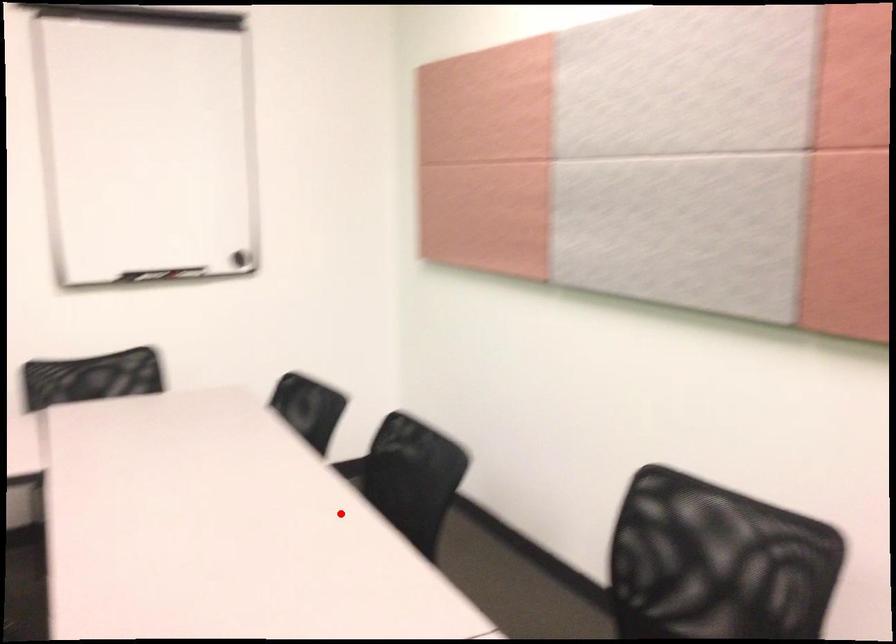
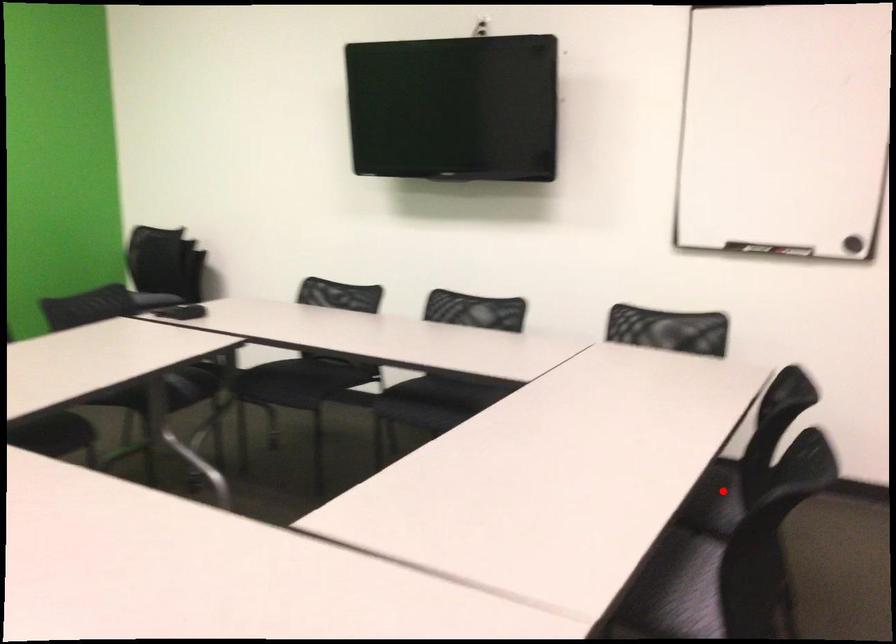
I am providing you with two images of the same scene from different viewpoints. A red point is marked on the first image and another point is marked on the second image. Is the marked point in image1 the same physical position as the marked point in image2?

Yes